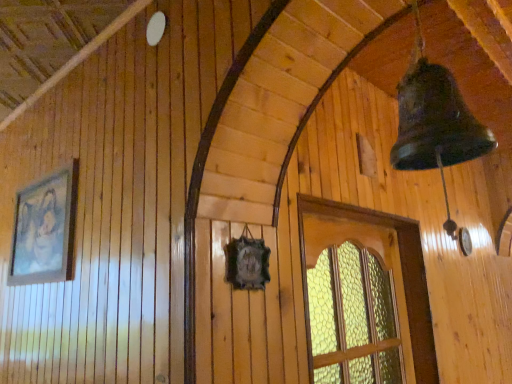
Question: Does translucent glass window at center have a lesser width compared to matte wooden picture frame at left?

Choices:
 (A) no
 (B) yes

Answer: (A)

Question: Does translucent glass window at center come behind matte wooden picture frame at left?

Choices:
 (A) no
 (B) yes

Answer: (A)

Question: Does translucent glass window at center have a larger size compared to matte wooden picture frame at left?

Choices:
 (A) no
 (B) yes

Answer: (B)

Question: From a real-world perspective, is translucent glass window at center on matte wooden picture frame at left?

Choices:
 (A) yes
 (B) no

Answer: (B)

Question: From the image's perspective, is translucent glass window at center over matte wooden picture frame at left?

Choices:
 (A) no
 (B) yes

Answer: (A)

Question: Is translucent glass window at center outside of matte wooden picture frame at left?

Choices:
 (A) yes
 (B) no

Answer: (A)

Question: Would you consider matte wooden picture frame at left to be distant from translucent glass window at center?

Choices:
 (A) yes
 (B) no

Answer: (A)

Question: From a real-world perspective, is matte wooden picture frame at left over translucent glass window at center?

Choices:
 (A) yes
 (B) no

Answer: (A)

Question: Is matte wooden picture frame at left oriented away from translucent glass window at center?

Choices:
 (A) yes
 (B) no

Answer: (B)

Question: Can you confirm if matte wooden picture frame at left is positioned to the right of translucent glass window at center?

Choices:
 (A) yes
 (B) no

Answer: (B)

Question: Are matte wooden picture frame at left and translucent glass window at center beside each other?

Choices:
 (A) no
 (B) yes

Answer: (A)

Question: From the image's perspective, is matte wooden picture frame at left on top of translucent glass window at center?

Choices:
 (A) yes
 (B) no

Answer: (A)

Question: Considering the relative positions of translucent glass window at center and matte wooden picture frame at left in the image provided, is translucent glass window at center to the left or to the right of matte wooden picture frame at left?

Choices:
 (A) right
 (B) left

Answer: (A)